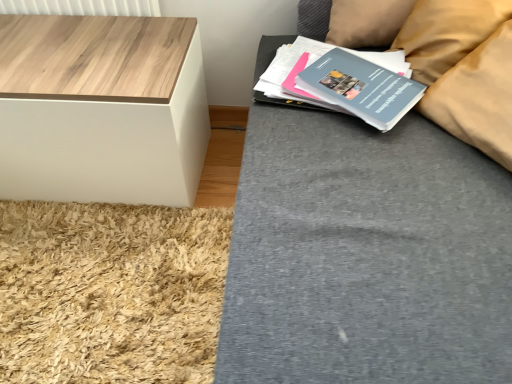
Question: Visually, is matte gray paperback book at upper right, the second paperback book positioned from the back, positioned to the left or to the right of beige fabric pillow at upper right?

Choices:
 (A) left
 (B) right

Answer: (A)

Question: Is matte gray paperback book at upper right, the first paperback book when ordered from front to back, in front of or behind beige fabric pillow at upper right in the image?

Choices:
 (A) front
 (B) behind

Answer: (A)

Question: Which object is positioned farthest from the wooden white cube at left?

Choices:
 (A) matte blue paperback book at upper right, the 2th paperback book in the front-to-back sequence
 (B) matte gray paperback book at upper right, the first paperback book when ordered from front to back
 (C) beige fabric pillow at upper right

Answer: (C)

Question: Considering the real-world distances, which object is closest to the matte blue paperback book at upper right, the 2th paperback book in the front-to-back sequence?

Choices:
 (A) wooden white cube at left
 (B) beige fabric pillow at upper right
 (C) matte gray paperback book at upper right, the first paperback book when ordered from front to back

Answer: (C)